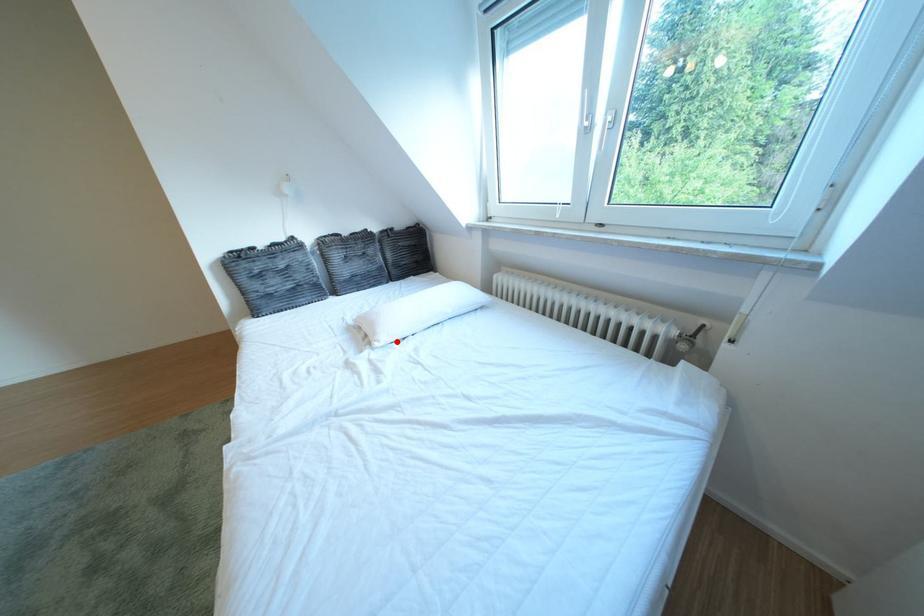
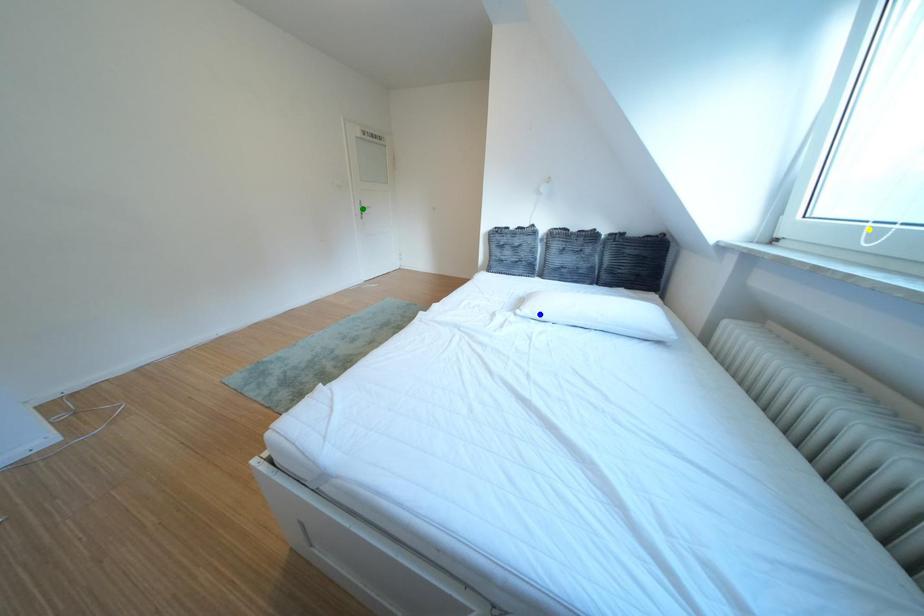
Question: I am providing you with two images of the same scene from different viewpoints. A red point is marked on the first image. You are given multiple points on the second image. Which mark in image 2 goes with the point in image 1?

Choices:
 (A) yellow point
 (B) blue point
 (C) green point

Answer: (B)